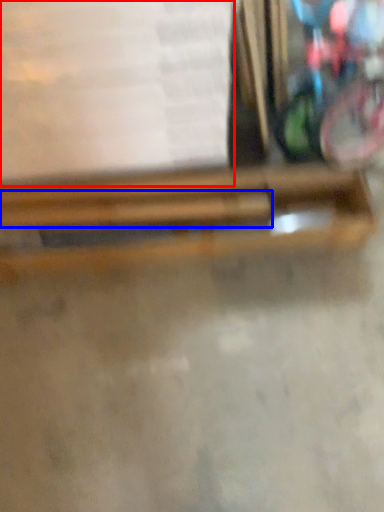
Question: Which of the following is the closest to the observer, paperback book (highlighted by a red box) or wood (highlighted by a blue box)?

Choices:
 (A) paperback book
 (B) wood

Answer: (A)